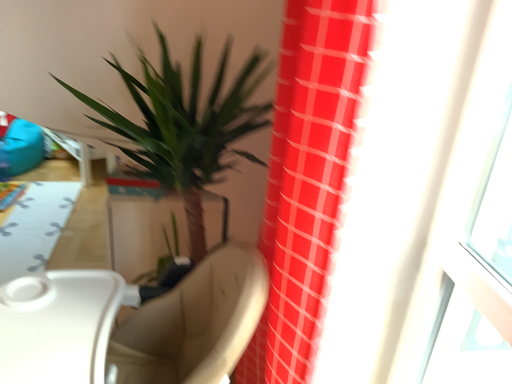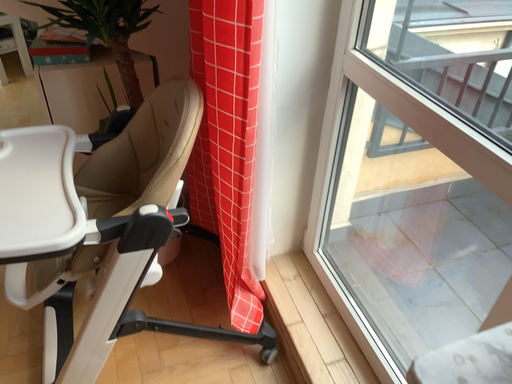
Question: How did the camera likely rotate when shooting the video?

Choices:
 (A) rotated upward
 (B) rotated downward

Answer: (B)